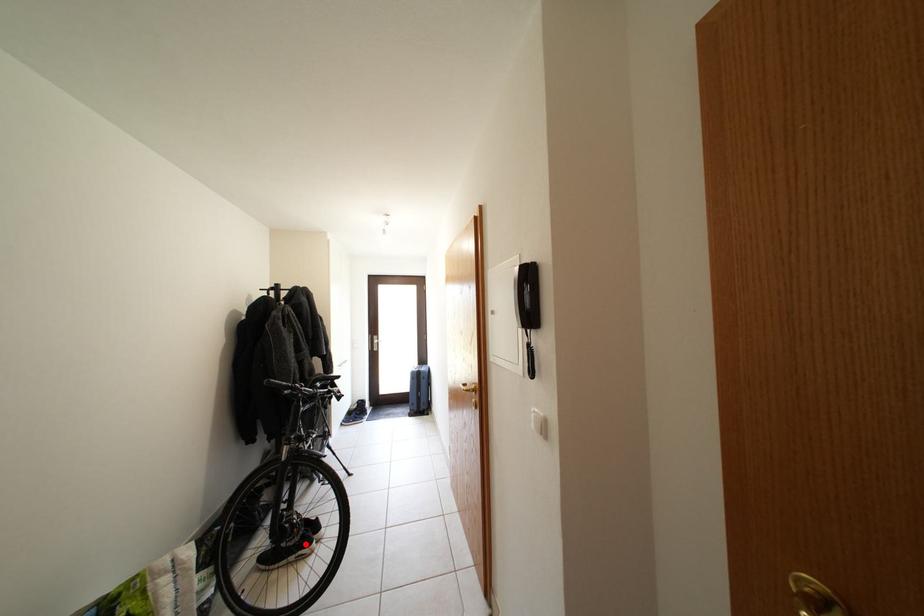
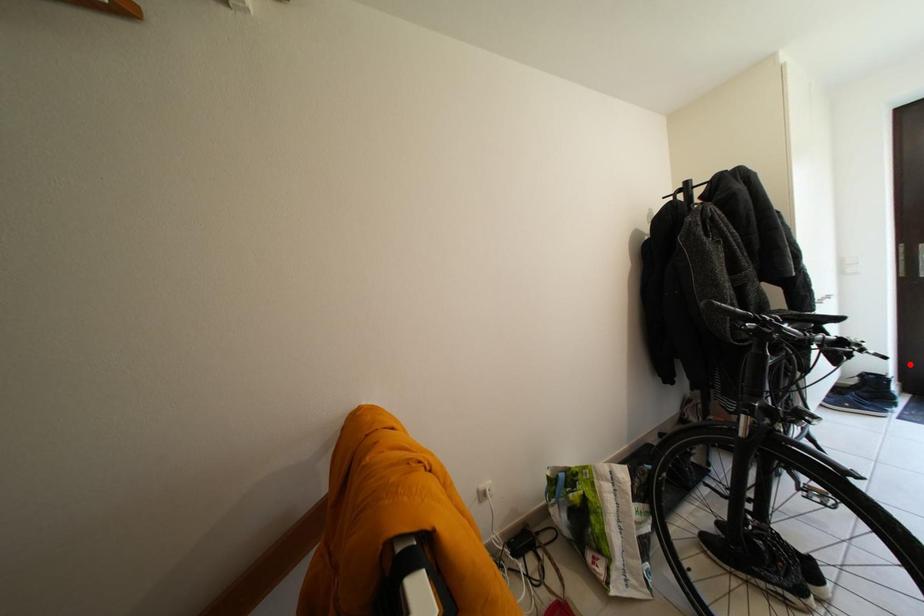
I am providing you with two images of the same scene from different viewpoints. A red point is marked on the first image and another point is marked on the second image. Does the point marked in image1 correspond to the same location as the one in image2?

No